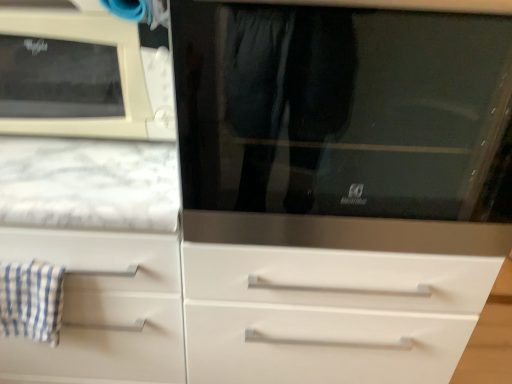
Question: Is beige plastic microwave at upper left taller or shorter than stainless steel microwave at center?

Choices:
 (A) tall
 (B) short

Answer: (B)

Question: Is beige plastic microwave at upper left in front of or behind stainless steel microwave at center in the image?

Choices:
 (A) front
 (B) behind

Answer: (B)

Question: Considering the real-world distances, which object is closest to the stainless steel microwave at center?

Choices:
 (A) blue checkered cloth at left
 (B) beige plastic microwave at upper left

Answer: (B)

Question: Which of these objects is positioned closest to the stainless steel microwave at center?

Choices:
 (A) beige plastic microwave at upper left
 (B) blue checkered cloth at left

Answer: (A)